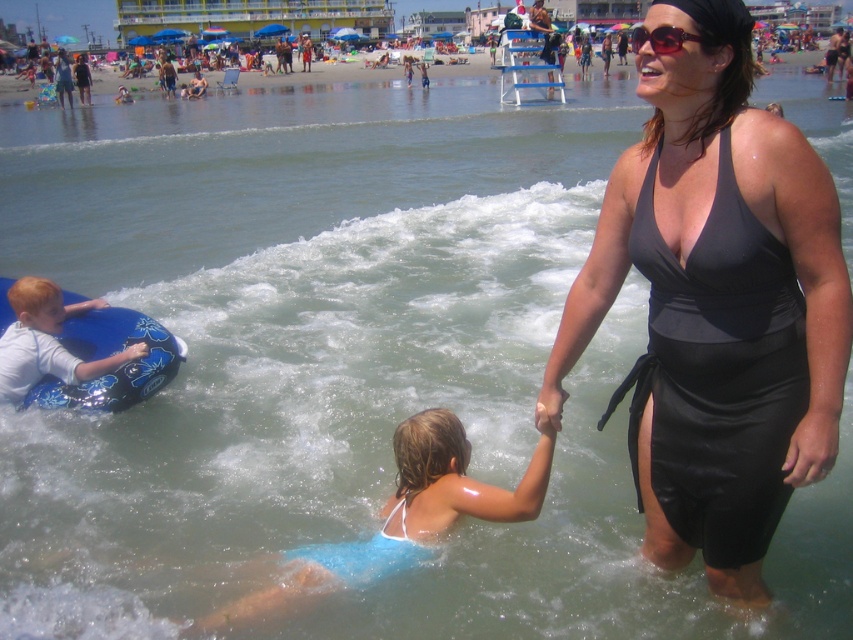
Question: Among these objects, which one is farthest from the camera?

Choices:
 (A) matte black swimsuit at center
 (B) blue rubber ring at left
 (C) light blue fabric swimsuit at lower center

Answer: (B)

Question: Among these objects, which one is farthest from the camera?

Choices:
 (A) blue rubber ring at left
 (B) light blue fabric swimsuit at lower center

Answer: (A)

Question: Can you confirm if light blue fabric swimsuit at lower center is positioned below blue rubber ring at left?

Choices:
 (A) no
 (B) yes

Answer: (B)

Question: Considering the relative positions of matte black swimsuit at center and blue rubber ring at left in the image provided, where is matte black swimsuit at center located with respect to blue rubber ring at left?

Choices:
 (A) right
 (B) left

Answer: (A)

Question: Can you confirm if matte black swimsuit at center is thinner than light blue fabric swimsuit at lower center?

Choices:
 (A) yes
 (B) no

Answer: (A)

Question: Among these points, which one is farthest from the camera?

Choices:
 (A) (1, 300)
 (B) (438, 484)

Answer: (A)